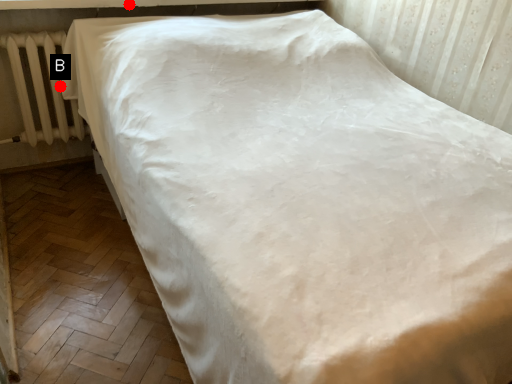
Question: Two points are circled on the image, labeled by A and B beside each circle. Which point is closer to the camera?

Choices:
 (A) A is closer
 (B) B is closer

Answer: (A)